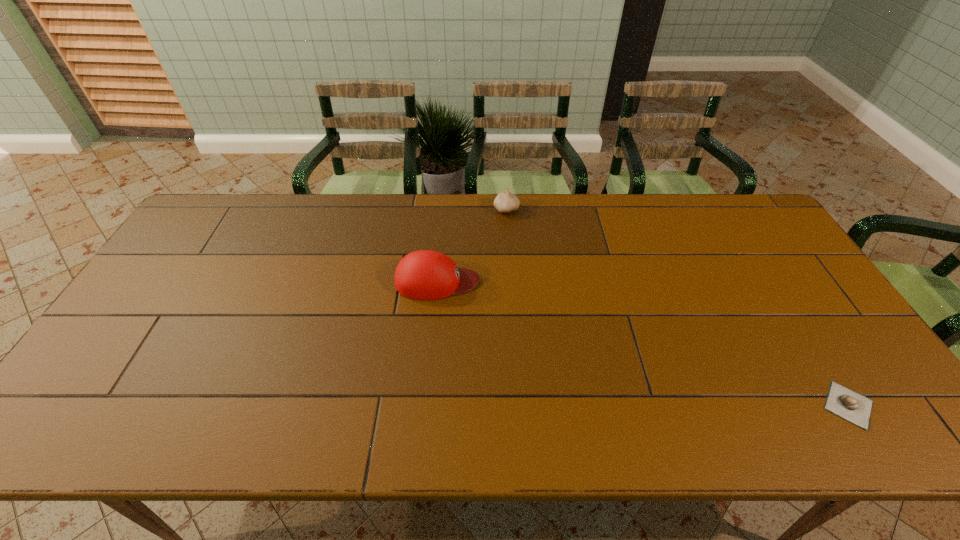
The height and width of the screenshot is (540, 960). I want to click on the second nearest object, so click(x=425, y=274).

The width and height of the screenshot is (960, 540). I want to click on the leftmost object, so [x=425, y=274].

Locate an element on the screen. Image resolution: width=960 pixels, height=540 pixels. the second object from left to right is located at coordinates (x=505, y=202).

What are the coordinates of `the farther garlic` in the screenshot? It's located at (505, 202).

Locate an element on the screen. Image resolution: width=960 pixels, height=540 pixels. the nearer garlic is located at coordinates (841, 401).

Find the location of `the right garlic`. the right garlic is located at coordinates (841, 401).

This screenshot has height=540, width=960. I want to click on vacant space located on the front-facing side of the leftmost object, so click(558, 281).

This screenshot has height=540, width=960. In order to click on vacant space situated 0.200m on the right of the taller garlic in this screenshot , I will do pos(578,210).

Where is `vacant area located 0.110m on the left of the rightmost object`? The width and height of the screenshot is (960, 540). vacant area located 0.110m on the left of the rightmost object is located at coordinates (774, 405).

Locate an element on the screen. This screenshot has height=540, width=960. object at the far edge is located at coordinates (505, 202).